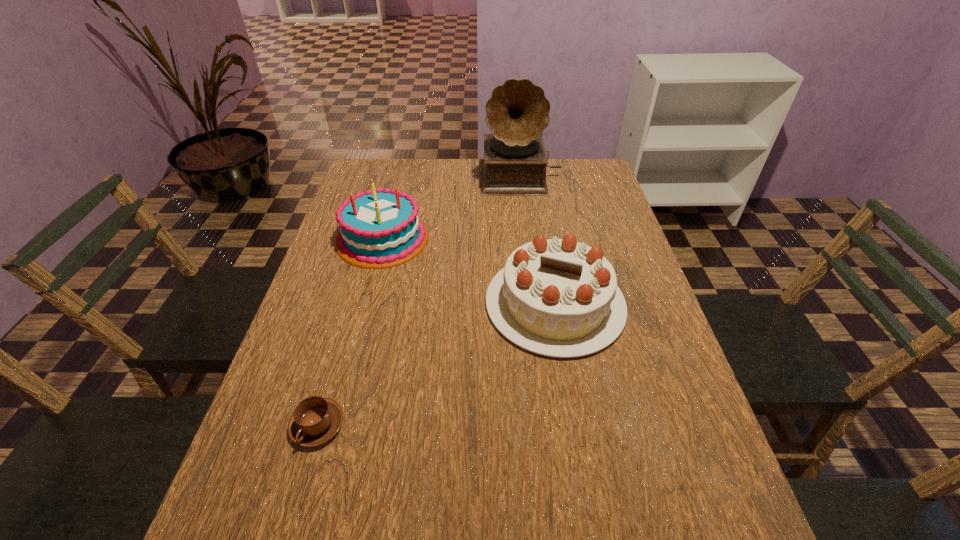
Locate an element on the screen. vacant space that satisfies the following two spatial constraints: 1. from the horn of the farthest object; 2. on the right side of the right birthday cake is located at coordinates (537, 304).

The image size is (960, 540). I want to click on free space that satisfies the following two spatial constraints: 1. on the front side of the right birthday cake; 2. on the right side of the left birthday cake, so click(366, 304).

Locate an element on the screen. The width and height of the screenshot is (960, 540). blank space that satisfies the following two spatial constraints: 1. on the front side of the right birthday cake; 2. on the left side of the left birthday cake is located at coordinates (366, 304).